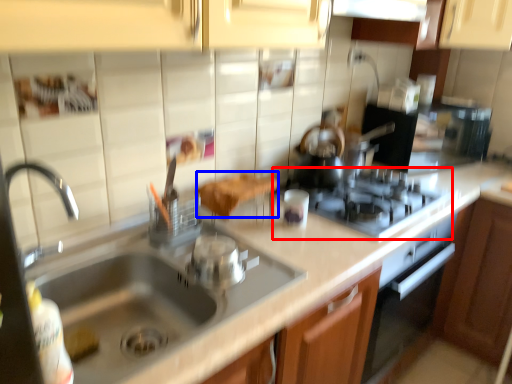
Question: Which of the following is the farthest to the observer, gas stove (highlighted by a red box) or food (highlighted by a blue box)?

Choices:
 (A) gas stove
 (B) food

Answer: (A)